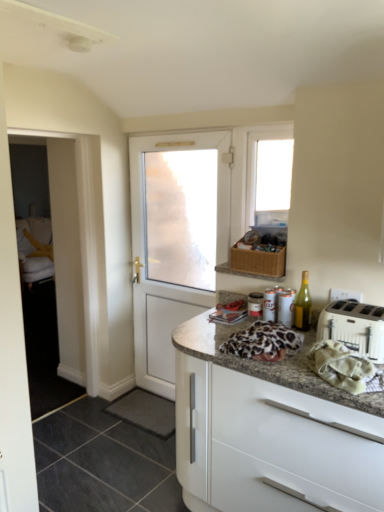
At what (x,y) coordinates should I click in order to perform the action: click on free space above dark gray tile at lower left, which is the 1th tile from front to back (from a real-world perspective). Please return your answer as a coordinate pair (x, y). Looking at the image, I should click on (126, 450).